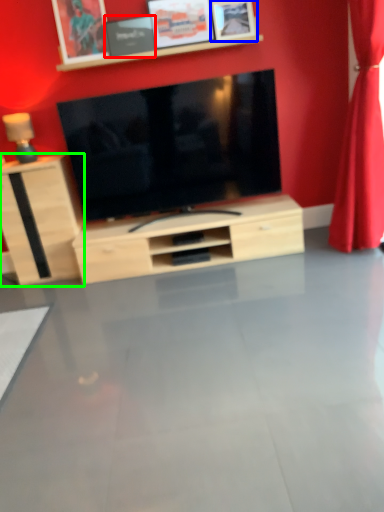
Question: Estimate the real-world distances between objects in this image. Which object is farther from picture frame (highlighted by a red box), picture frame (highlighted by a blue box) or cabinetry (highlighted by a green box)?

Choices:
 (A) picture frame
 (B) cabinetry

Answer: (B)